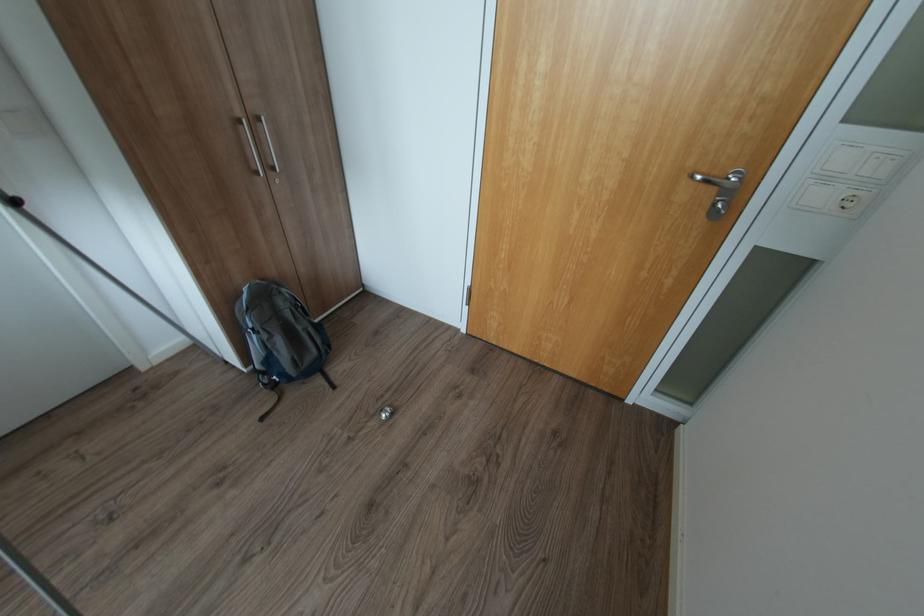
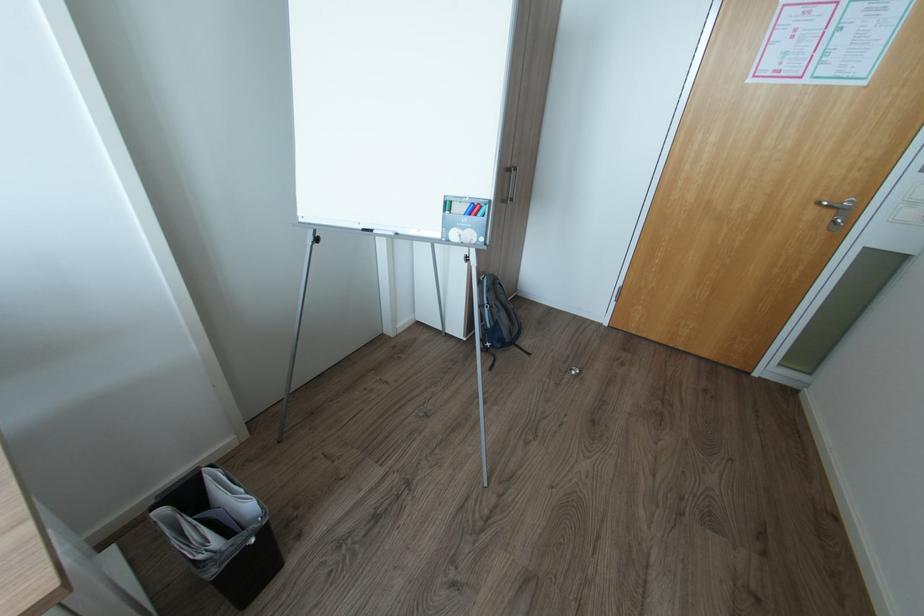
The point at (724, 206) is marked in the first image. Where is the corresponding point in the second image?

(845, 221)